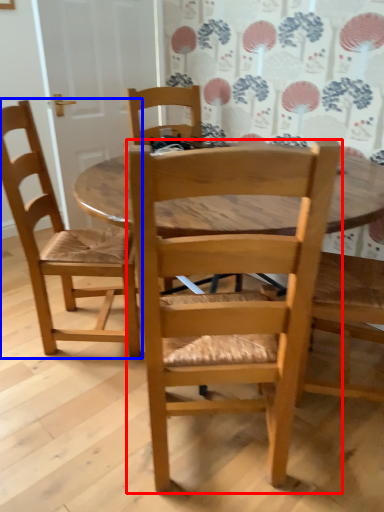
Question: Among these objects, which one is nearest to the camera, chair (highlighted by a red box) or chair (highlighted by a blue box)?

Choices:
 (A) chair
 (B) chair

Answer: (A)